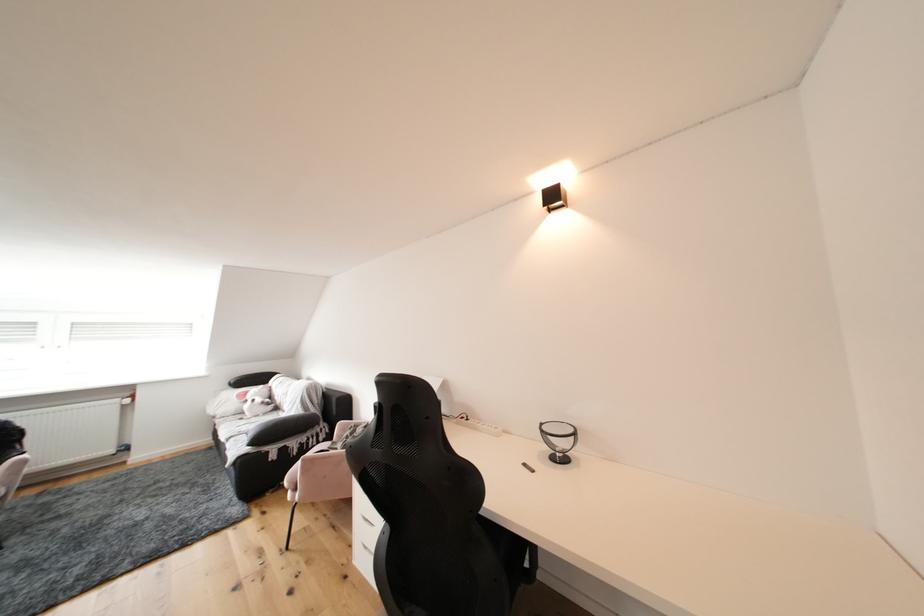
Where would you sit the black chair sitting surface? Please return your answer as a coordinate pair (x, y).

(503, 537)